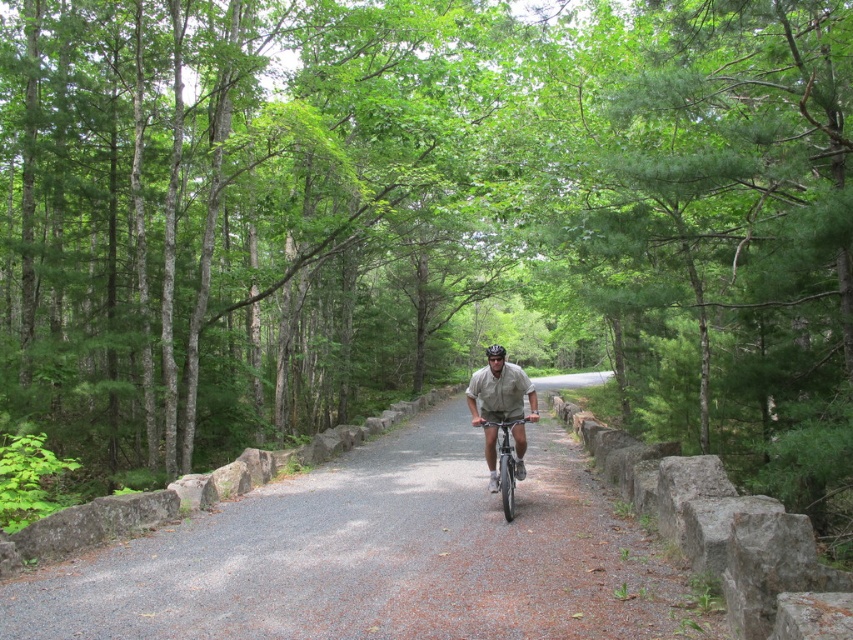
You are a delivery drone operator. Your drone needs to fly from the gray gravel path at center to the silver metallic bicycle at center. What is the shortest distance your drone must travel?

The shortest distance between the gray gravel path at center and the silver metallic bicycle at center is 2.91 meters, so the drone must travel at least 2.91 meters.